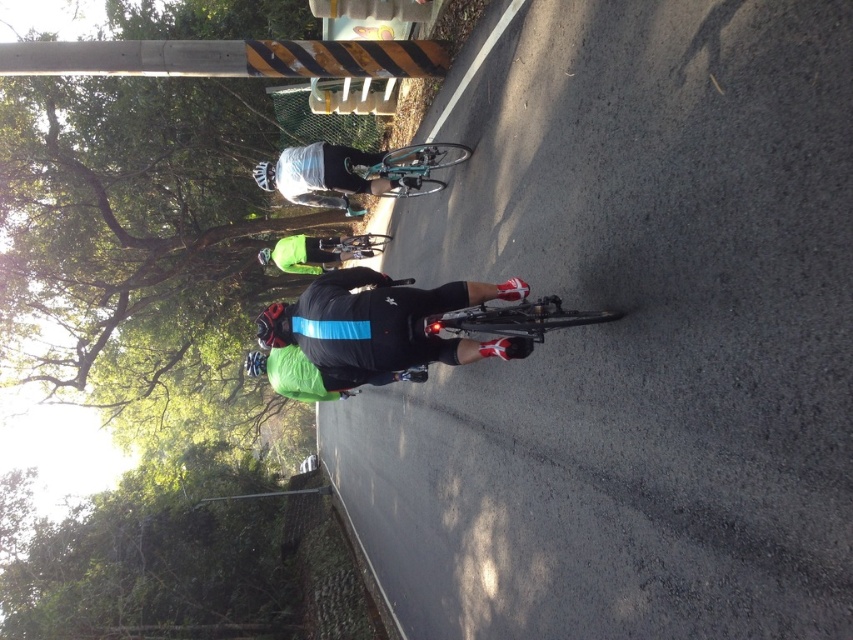
Question: Among these objects, which one is farthest from the camera?

Choices:
 (A) black matte cycling suit at center
 (B) green matte jacket at center
 (C) matte black bicycle at center
 (D) black matte bicycle helmet at center

Answer: (B)

Question: Estimate the real-world distances between objects in this image. Which object is farther from the teal glossy bicycle at center?

Choices:
 (A) green matte jacket at center
 (B) matte black bicycle at center
 (C) black matte cycling suit at center

Answer: (A)

Question: Does shiny black bicycle at center have a larger size compared to teal glossy bicycle at center?

Choices:
 (A) no
 (B) yes

Answer: (A)

Question: Is teal glossy bicycle at center to the left of green matte jacket at center from the viewer's perspective?

Choices:
 (A) yes
 (B) no

Answer: (B)

Question: Which of the following is the closest to the observer?

Choices:
 (A) shiny black bicycle at center
 (B) green matte jacket at center

Answer: (A)

Question: Is teal glossy bicycle at center bigger than green matte jacket at center?

Choices:
 (A) yes
 (B) no

Answer: (B)